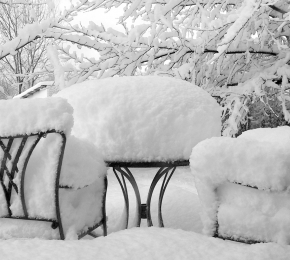
Locate an element on the screen. The width and height of the screenshot is (290, 260). arm rest is located at coordinates (77, 187).